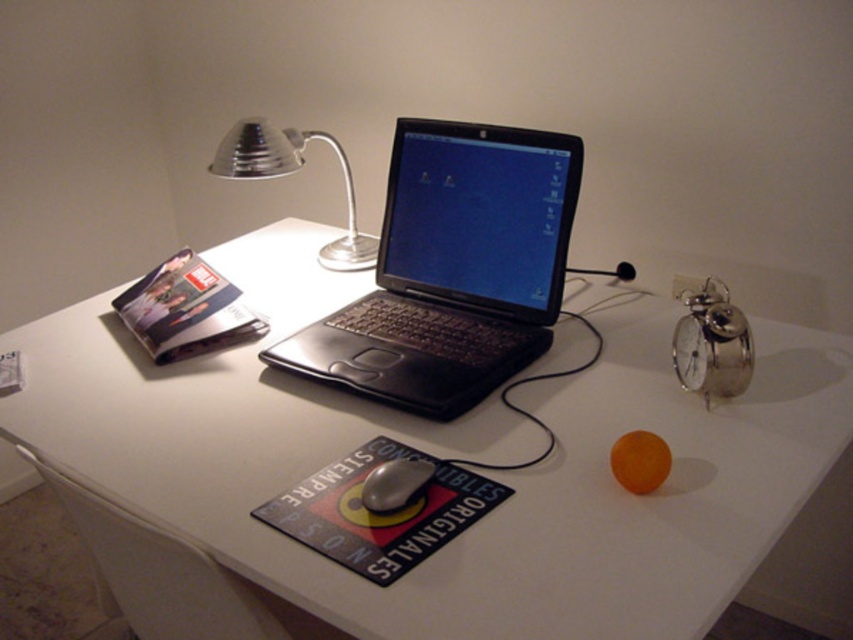
You have a small box that is exactly the same size as the black rubber mouse at center. You want to place this box next to the silver metallic alarm clock at upper right. Will the box fit in the space next to the alarm clock without overlapping it?

The silver metallic alarm clock at upper right is wider than the black rubber mouse at center. Since the box is the same size as the mouse, it will fit next to the alarm clock without overlapping because there is enough space.